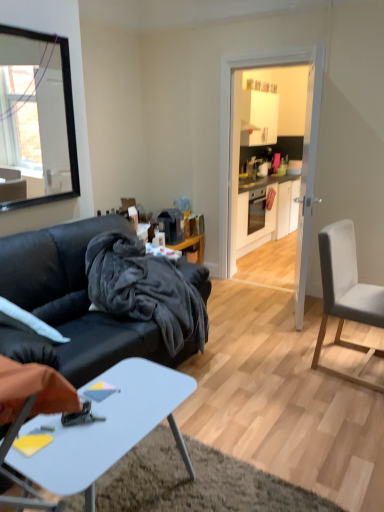
In order to click on white glossy door at center in this screenshot , I will do `click(232, 127)`.

This screenshot has height=512, width=384. Describe the element at coordinates (267, 213) in the screenshot. I see `white glossy cabinet at center` at that location.

The height and width of the screenshot is (512, 384). What do you see at coordinates (73, 302) in the screenshot? I see `velvet dark gray couch at left` at bounding box center [73, 302].

In order to face black fuzzy blanket at center, should I rotate leftwards or rightwards?

You should rotate left by 8.031 degrees.

At what (x,y) coordinates should I click in order to perform the action: click on white plastic desk at lower center. Please return your answer as a coordinate pair (x, y). This screenshot has width=384, height=512. Looking at the image, I should click on (106, 429).

Identify the location of white glossy door at center. Image resolution: width=384 pixels, height=512 pixels. (232, 127).

From a real-world perspective, relative to white glossy cabinet at center, is light gray fabric chair at right vertically above or below?

In terms of real-world spatial position, light gray fabric chair at right is above white glossy cabinet at center.

Is the depth of light gray fabric chair at right less than that of white glossy cabinet at center?

Yes, it is in front of white glossy cabinet at center.

Is light gray fabric chair at right facing away from white glossy cabinet at center?

No.

In the scene shown: Is light gray fabric chair at right wider or thinner than white plastic desk at lower center?

In the image, light gray fabric chair at right appears to be wider than white plastic desk at lower center.

From the image's perspective, is light gray fabric chair at right positioned above or below white plastic desk at lower center?

light gray fabric chair at right is above white plastic desk at lower center.

Is light gray fabric chair at right not inside white plastic desk at lower center?

Yes, light gray fabric chair at right is located beyond the bounds of white plastic desk at lower center.

Is white plastic desk at lower center at the back of light gray fabric chair at right?

light gray fabric chair at right does not have its back to white plastic desk at lower center.

Does point (261, 226) appear closer or farther from the camera than point (233, 73)?

Point (261, 226) appears to be farther away from the viewer than point (233, 73).

From the image's perspective, which one is positioned higher, white glossy cabinet at center or white glossy door at center?

From the image's view, white glossy cabinet at center is above.

Does white glossy cabinet at center come in front of white glossy door at center?

No, white glossy cabinet at center is further to the viewer.

In terms of size, does white plastic desk at lower center appear bigger or smaller than white glossy cabinet at upper center?

In the image, white plastic desk at lower center appears to be smaller than white glossy cabinet at upper center.

Is white plastic desk at lower center oriented away from white glossy cabinet at upper center?

No, white plastic desk at lower center is not facing away from white glossy cabinet at upper center.

In the scene shown: Considering the sizes of white plastic desk at lower center and white glossy cabinet at upper center in the image, is white plastic desk at lower center wider or thinner than white glossy cabinet at upper center?

Considering their sizes, white plastic desk at lower center looks broader than white glossy cabinet at upper center.

How much distance is there between white plastic desk at lower center and white glossy cabinet at upper center?

The distance of white plastic desk at lower center from white glossy cabinet at upper center is 23.25 feet.

Between black fuzzy blanket at center and light gray fabric chair at right, which one is positioned in front?

Positioned in front is light gray fabric chair at right.

Does black fuzzy blanket at center appear on the right side of light gray fabric chair at right?

No, black fuzzy blanket at center is not to the right of light gray fabric chair at right.

Looking at this image, can you tell me how much black fuzzy blanket at center and light gray fabric chair at right differ in facing direction?

2.35 degrees.

From the image's perspective, is white glossy cabinet at upper center located above or below white plastic desk at lower center?

white glossy cabinet at upper center is above white plastic desk at lower center.

Locate an element on the screen. desk below the white glossy cabinet at upper center (from a real-world perspective) is located at coordinates (106, 429).

Are white glossy cabinet at upper center and white plastic desk at lower center located far from each other?

Indeed, white glossy cabinet at upper center is not near white plastic desk at lower center.

Is white glossy cabinet at upper center oriented away from white plastic desk at lower center?

No, white glossy cabinet at upper center is not facing the opposite direction of white plastic desk at lower center.

From the image's perspective, relative to light gray fabric chair at right, is white glossy cabinet at center above or below?

white glossy cabinet at center is above light gray fabric chair at right.

From a real-world perspective, is white glossy cabinet at center positioned above or below light gray fabric chair at right?

Clearly, from a real-world perspective, white glossy cabinet at center is below light gray fabric chair at right.

How much distance is there between white glossy cabinet at center and light gray fabric chair at right?

white glossy cabinet at center is 2.71 meters from light gray fabric chair at right.

Can you confirm if white glossy cabinet at center is wider than light gray fabric chair at right?

Correct, the width of white glossy cabinet at center exceeds that of light gray fabric chair at right.

The width and height of the screenshot is (384, 512). Identify the location of chair on the left of white glossy cabinet at center. (346, 288).

Identify the location of chair that appears on the right of white plastic desk at lower center. The image size is (384, 512). (346, 288).

From the picture: Estimate the real-world distances between objects in this image. Which object is closer to light gray fabric chair at right, white glossy cabinet at upper center or white plastic desk at lower center?

white plastic desk at lower center is positioned closer to the anchor light gray fabric chair at right.

Based on their spatial positions, is white glossy cabinet at center or white plastic desk at lower center further from light gray fabric chair at right?

white glossy cabinet at center.

Looking at this image, from the image, which object appears to be farther from white glossy door at center, white glossy cabinet at upper center or velvet dark gray couch at left?

white glossy cabinet at upper center is positioned further to the anchor white glossy door at center.

Considering their positions, is black fuzzy blanket at center positioned further to white glossy cabinet at center than light gray fabric chair at right?

black fuzzy blanket at center is further to white glossy cabinet at center.

When comparing their distances from white glossy cabinet at center, does white glossy door at center or light gray fabric chair at right seem further?

The object further to white glossy cabinet at center is light gray fabric chair at right.

Based on their spatial positions, is white glossy door at center or white plastic desk at lower center closer to white glossy cabinet at center?

white glossy door at center is positioned closer to the anchor white glossy cabinet at center.

Considering their positions, is light gray fabric chair at right positioned closer to white plastic desk at lower center than white glossy cabinet at center?

light gray fabric chair at right lies closer to white plastic desk at lower center than the other object.

When comparing their distances from white plastic desk at lower center, does light gray fabric chair at right or white glossy cabinet at upper center seem closer?

light gray fabric chair at right is positioned closer to the anchor white plastic desk at lower center.

Image resolution: width=384 pixels, height=512 pixels. I want to click on chair between velvet dark gray couch at left and white glossy cabinet at center from front to back, so click(346, 288).

Where is `material positioned between velvet dark gray couch at left and white glossy door at center from near to far`? material positioned between velvet dark gray couch at left and white glossy door at center from near to far is located at coordinates click(x=145, y=289).

At what (x,y) coordinates should I click in order to perform the action: click on glass door between white plastic desk at lower center and white glossy cabinet at center along the z-axis. Please return your answer as a coordinate pair (x, y). Image resolution: width=384 pixels, height=512 pixels. Looking at the image, I should click on (232, 127).

What are the coordinates of `material located between light gray fabric chair at right and white glossy cabinet at upper center in the depth direction` in the screenshot? It's located at (145, 289).